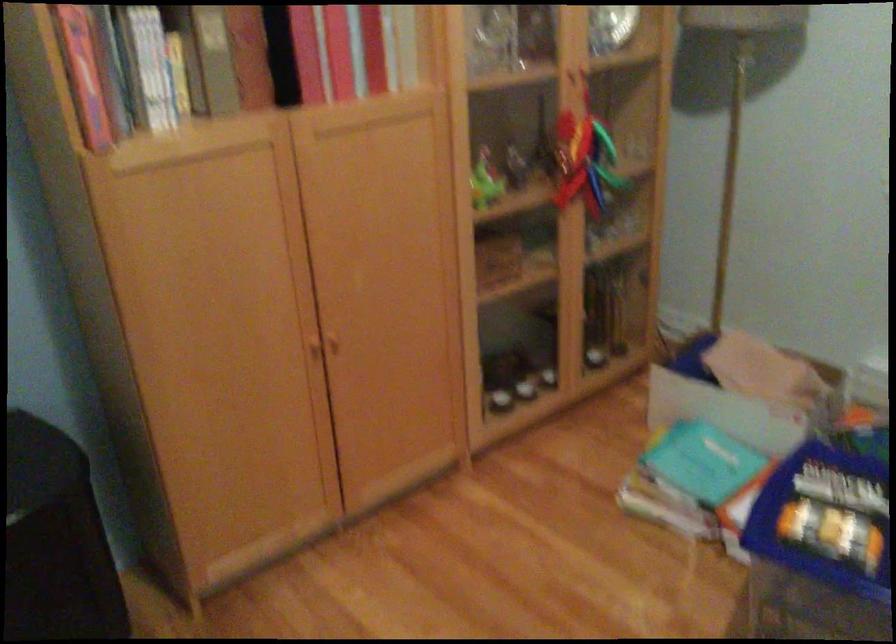
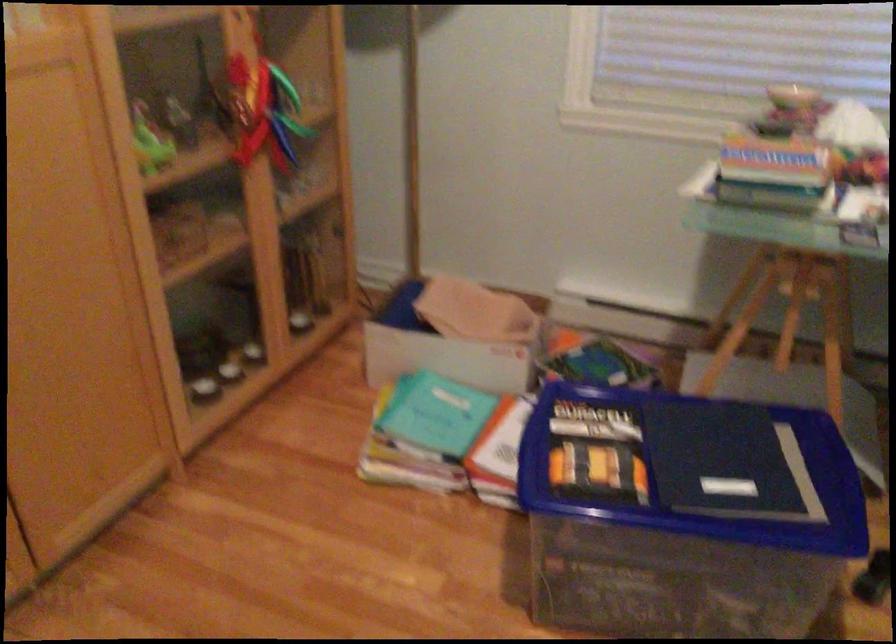
In a continuous first-person perspective shot, in which direction is the camera moving?

The cameraman moved toward left, forward.